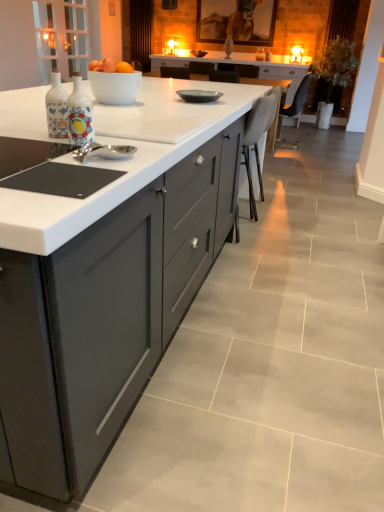
This screenshot has width=384, height=512. Find the location of `matte gray plate at center`. matte gray plate at center is located at coordinates (199, 96).

Which of these two, dark brown leather chair at upper right, acting as the 1th chair starting from the right, or matte gray cabinetry at center, stands taller?

matte gray cabinetry at center is taller.

Considering the sizes of objects dark brown leather chair at upper right, which is the 2th chair from left to right, and matte gray cabinetry at center in the image provided, who is wider, dark brown leather chair at upper right, which is the 2th chair from left to right, or matte gray cabinetry at center?

matte gray cabinetry at center is wider.

From a real-world perspective, who is located lower, dark brown leather chair at upper right, arranged as the 1th chair when viewed from the top, or matte gray cabinetry at center?

matte gray cabinetry at center, from a real-world perspective.

In order to click on cabinetry that is in front of the decorative ceramic bottle at center-left in this screenshot , I will do `click(96, 289)`.

Considering the relative sizes of matte gray cabinetry at center and decorative ceramic bottle at center-left in the image provided, is matte gray cabinetry at center wider than decorative ceramic bottle at center-left?

Correct, the width of matte gray cabinetry at center exceeds that of decorative ceramic bottle at center-left.

Is matte gray cabinetry at center in contact with decorative ceramic bottle at center-left?

No, matte gray cabinetry at center is not beside decorative ceramic bottle at center-left.

Considering the relative sizes of white leather chair at center, which is counted as the first chair, starting from the bottom, and matte gray plate at center in the image provided, is white leather chair at center, which is counted as the first chair, starting from the bottom, wider than matte gray plate at center?

Indeed, white leather chair at center, which is counted as the first chair, starting from the bottom, has a greater width compared to matte gray plate at center.

How many degrees apart are the facing directions of white leather chair at center, the second chair viewed from the top, and matte gray plate at center?

They differ by 89.4 degrees in their facing directions.

From a real-world perspective, which object rests below the other?

white leather chair at center, the second chair viewed from the top, from a real-world perspective.

In the image, there is a matte gray plate at center. At what (x,y) coordinates should I click in order to perform the action: click on chair below it (from the image's perspective). Please return your answer as a coordinate pair (x, y). The height and width of the screenshot is (512, 384). Looking at the image, I should click on (257, 139).

Is matte gray cabinetry at center further to camera compared to white glossy bowl at center?

No, matte gray cabinetry at center is closer to the camera.

Is matte gray cabinetry at center turned away from white glossy bowl at center?

No, matte gray cabinetry at center is not facing the opposite direction of white glossy bowl at center.

From a real-world perspective, is matte gray cabinetry at center beneath white glossy bowl at center?

Correct, in the physical world, matte gray cabinetry at center is lower than white glossy bowl at center.

Are matte gray cabinetry at center and white glossy bowl at center located far from each other?

They are positioned close to each other.

From the image's perspective, is white glossy bowl at center above or below white leather chair at center, which is the first chair from left to right?

From the image's perspective, white glossy bowl at center appears above white leather chair at center, which is the first chair from left to right.

Considering the sizes of white glossy bowl at center and white leather chair at center, the 1th chair in the front-to-back sequence, in the image, is white glossy bowl at center taller or shorter than white leather chair at center, the 1th chair in the front-to-back sequence,?

Considering their sizes, white glossy bowl at center has less height than white leather chair at center, the 1th chair in the front-to-back sequence.

Does white glossy bowl at center turn towards white leather chair at center, which is counted as the first chair, starting from the bottom?

No, white glossy bowl at center is not oriented towards white leather chair at center, which is counted as the first chair, starting from the bottom.

In the scene shown: Can you confirm if white glossy bowl at center is wider than white leather chair at center, which is the first chair from left to right?

No.

From a real-world perspective, which is physically below, white glossy bowl at center or matte gray cabinetry at center?

matte gray cabinetry at center, from a real-world perspective.

Which point is more distant from viewer, [104,80] or [2,279]?

Positioned behind is point [104,80].

From the image's perspective, who appears lower, white glossy bowl at center or matte gray cabinetry at center?

matte gray cabinetry at center appears lower in the image.

In the scene shown: Is white leather chair at center, which is counted as the first chair, starting from the bottom, placed right next to dark brown leather chair at upper right, which ranks as the 1th chair in back-to-front order?

No.

Consider the image. Considering the relative sizes of white leather chair at center, the 2th chair from the right, and dark brown leather chair at upper right, acting as the 1th chair starting from the right, in the image provided, is white leather chair at center, the 2th chair from the right, smaller than dark brown leather chair at upper right, acting as the 1th chair starting from the right,?

Correct, white leather chair at center, the 2th chair from the right, occupies less space than dark brown leather chair at upper right, acting as the 1th chair starting from the right.

Is white leather chair at center, which is counted as the first chair, starting from the bottom, situated inside dark brown leather chair at upper right, which is the 2th chair from left to right, or outside?

white leather chair at center, which is counted as the first chair, starting from the bottom, is not enclosed by dark brown leather chair at upper right, which is the 2th chair from left to right.

At what (x,y) coordinates should I click in order to perform the action: click on cabinetry on the left of dark brown leather chair at upper right, which ranks as the 1th chair in back-to-front order. Please return your answer as a coordinate pair (x, y). Looking at the image, I should click on 96,289.

Where is `bottle located above the matte gray cabinetry at center (from a real-world perspective)`? This screenshot has width=384, height=512. bottle located above the matte gray cabinetry at center (from a real-world perspective) is located at coordinates [x=79, y=114].

Which object lies nearer to the anchor point matte gray cabinetry at center, dark brown leather chair at upper right, which is the second chair from bottom to top, or decorative ceramic bottle at center-left?

Based on the image, decorative ceramic bottle at center-left appears to be nearer to matte gray cabinetry at center.

Based on their spatial positions, is white glossy bowl at center or matte gray plate at center closer to white leather chair at center, the 1th chair in the front-to-back sequence?

matte gray plate at center is closer to white leather chair at center, the 1th chair in the front-to-back sequence.

From the image, which object appears to be nearer to white glossy bowl at center, white leather chair at center, the 1th chair in the front-to-back sequence, or dark brown leather chair at upper right, which is the 2th chair from left to right?

white leather chair at center, the 1th chair in the front-to-back sequence, lies closer to white glossy bowl at center than the other object.

Which object lies nearer to the anchor point matte gray cabinetry at center, white glossy bowl at center or dark brown leather chair at upper right, which is the 2th chair from left to right?

Based on the image, white glossy bowl at center appears to be nearer to matte gray cabinetry at center.

Looking at the image, which one is located closer to white glossy bowl at center, white leather chair at center, the 2th chair from the right, or matte gray cabinetry at center?

matte gray cabinetry at center lies closer to white glossy bowl at center than the other object.

Estimate the real-world distances between objects in this image. Which object is closer to white glossy bowl at center, matte gray cabinetry at center or decorative ceramic bottle at center-left?

decorative ceramic bottle at center-left is closer to white glossy bowl at center.

Considering their positions, is matte gray cabinetry at center positioned closer to white leather chair at center, the 2th chair from the right, than dark brown leather chair at upper right, arranged as the 1th chair when viewed from the top?

Among the two, matte gray cabinetry at center is located nearer to white leather chair at center, the 2th chair from the right.

Considering their positions, is matte gray cabinetry at center positioned closer to matte gray plate at center than white leather chair at center, the second chair viewed from the top?

white leather chair at center, the second chair viewed from the top.

Find the location of `kitchen appliance between white glossy bowl at center and dark brown leather chair at upper right, arranged as the 1th chair when viewed from the top, in the front-back direction`. kitchen appliance between white glossy bowl at center and dark brown leather chair at upper right, arranged as the 1th chair when viewed from the top, in the front-back direction is located at coordinates [199, 96].

At what (x,y) coordinates should I click in order to perform the action: click on bottle between matte gray cabinetry at center and white glossy bowl at center in the front-back direction. Please return your answer as a coordinate pair (x, y). This screenshot has height=512, width=384. Looking at the image, I should click on (79, 114).

You are a GUI agent. You are given a task and a screenshot of the screen. Output one action in this format:
    pyautogui.click(x=<x>, y=<y>)
    Task: Click on the chair between white glossy bowl at center and dark brown leather chair at upper right, which is the 2th chair from left to right, in the front-back direction
    The height and width of the screenshot is (512, 384).
    Given the screenshot: What is the action you would take?
    pyautogui.click(x=257, y=139)

Where is `bowl between matte gray cabinetry at center and white leather chair at center, the 2th chair from the right, from front to back`? Image resolution: width=384 pixels, height=512 pixels. bowl between matte gray cabinetry at center and white leather chair at center, the 2th chair from the right, from front to back is located at coordinates (115, 87).